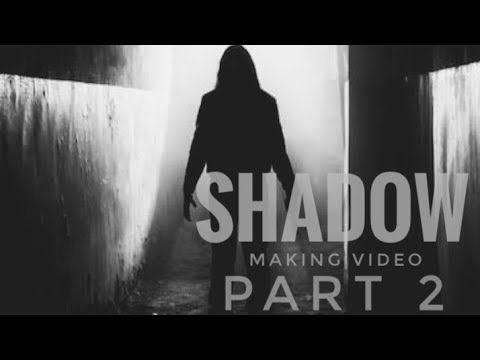
Image resolution: width=480 pixels, height=360 pixels. What are the coordinates of `dark wall` in the screenshot? It's located at (396, 127).